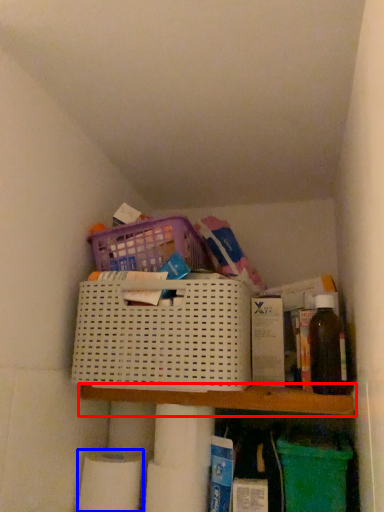
Question: Which point is closer to the camera, shelf (highlighted by a red box) or toilet paper (highlighted by a blue box)?

Choices:
 (A) shelf
 (B) toilet paper

Answer: (A)